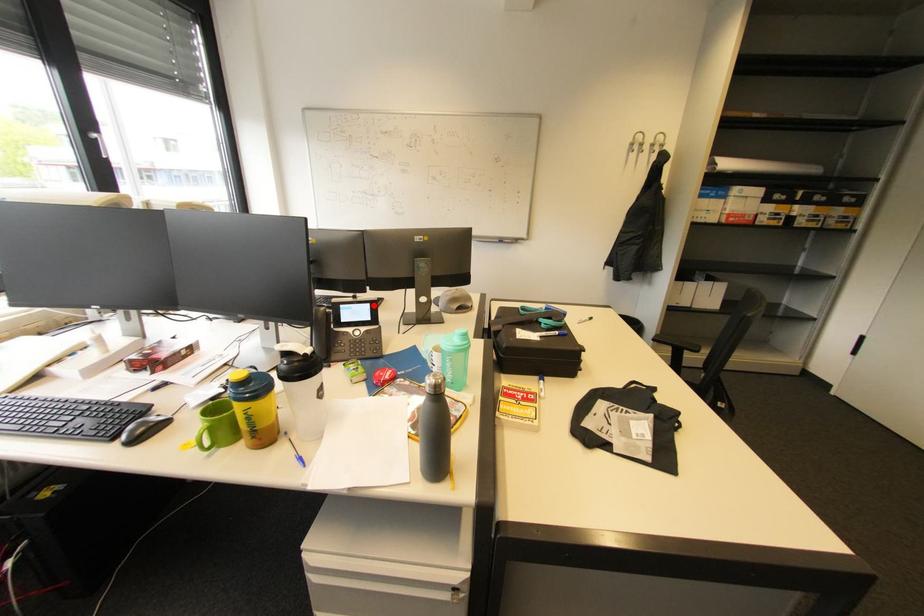
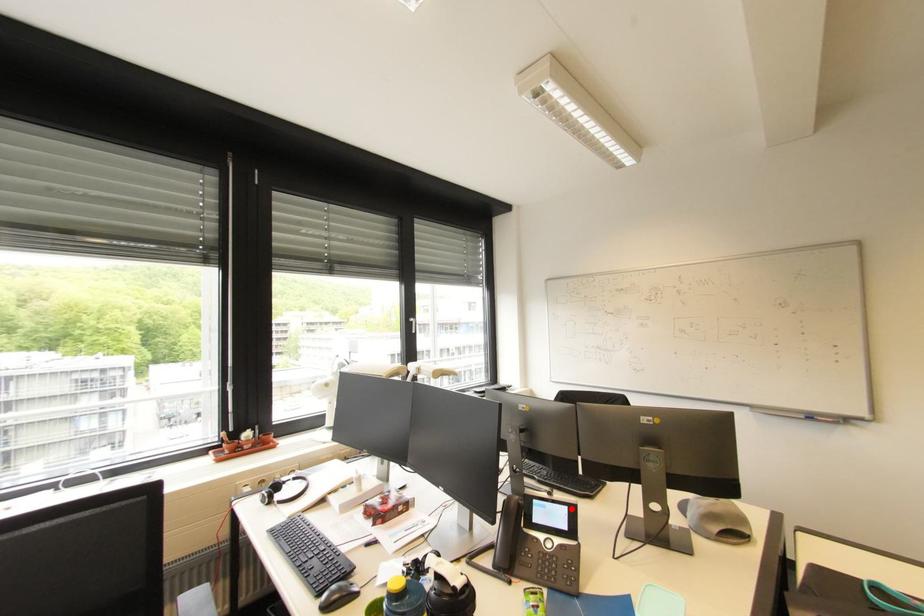
I am providing you with two images of the same scene from different viewpoints. A red point is marked on the first image and another point is marked on the second image. Is the marked point in image1 the same physical position as the marked point in image2?

Yes